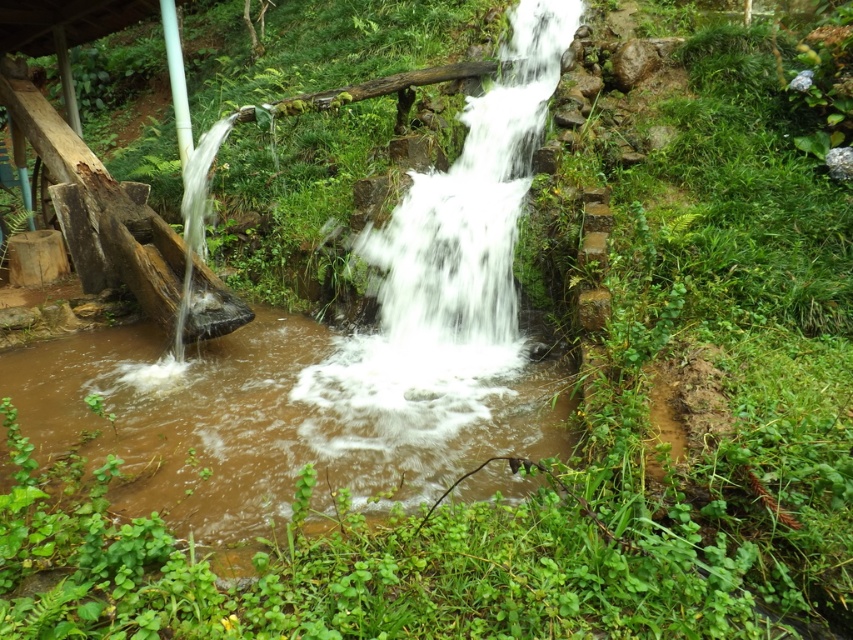
You are a small toy boat that is 30 centimeters long. You are currently floating on the brown muddy water at center. You want to reach the white frothy water at center. Is there enough space between them for you to navigate through?

The distance between the brown muddy water at center and white frothy water at center is 70.27 centimeters. Since the toy boat is 30 centimeters long, there is sufficient space for it to navigate through the 70.27 centimeter gap.

You are standing at the base of the waterfall in the image and want to reach the highest point of the water source. There are two points marked on the path you need to take. Which point should you aim for first, point (148, 472) or point (515, 74)?

You should aim for point (148, 472) first because it is in front of point (515, 74) along your path.